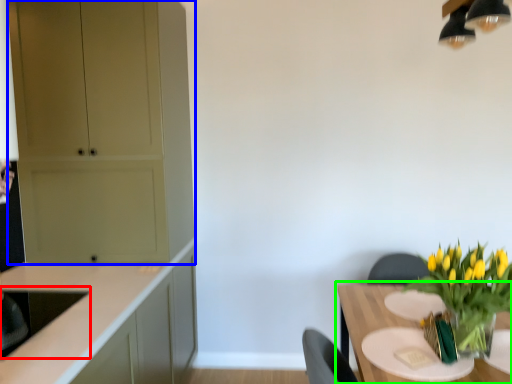
Question: Which object is the closest to the sink (highlighted by a red box)? Choose among these: cabinetry (highlighted by a blue box) or table (highlighted by a green box).

Choices:
 (A) cabinetry
 (B) table

Answer: (A)